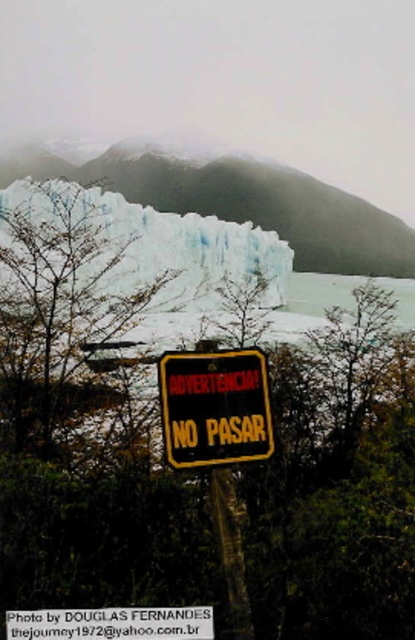
Is white ice glacier at upper center thinner than yellow matte sign at center?

Incorrect, white ice glacier at upper center's width is not less than yellow matte sign at center's.

Find the location of a particular element. white ice glacier at upper center is located at coordinates (248, 204).

The width and height of the screenshot is (415, 640). I want to click on white ice glacier at upper center, so click(x=248, y=204).

Is white ice at center smaller than yellow matte sign at center?

Actually, white ice at center might be larger than yellow matte sign at center.

Locate an element on the screen. Image resolution: width=415 pixels, height=640 pixels. white ice at center is located at coordinates (166, 237).

Where is `white ice at center`? Image resolution: width=415 pixels, height=640 pixels. white ice at center is located at coordinates (166, 237).

Based on the photo, measure the distance from white ice glacier at upper center to white ice at center.

white ice glacier at upper center is 172.28 feet from white ice at center.

Is white ice glacier at upper center shorter than white ice at center?

In fact, white ice glacier at upper center may be taller than white ice at center.

Which is in front, point (190, 179) or point (193, 236)?

Point (193, 236) is more forward.

You are a GUI agent. You are given a task and a screenshot of the screen. Output one action in this format:
    pyautogui.click(x=<x>, y=<y>)
    Task: Click on the white ice glacier at upper center
    
    Given the screenshot: What is the action you would take?
    pyautogui.click(x=248, y=204)